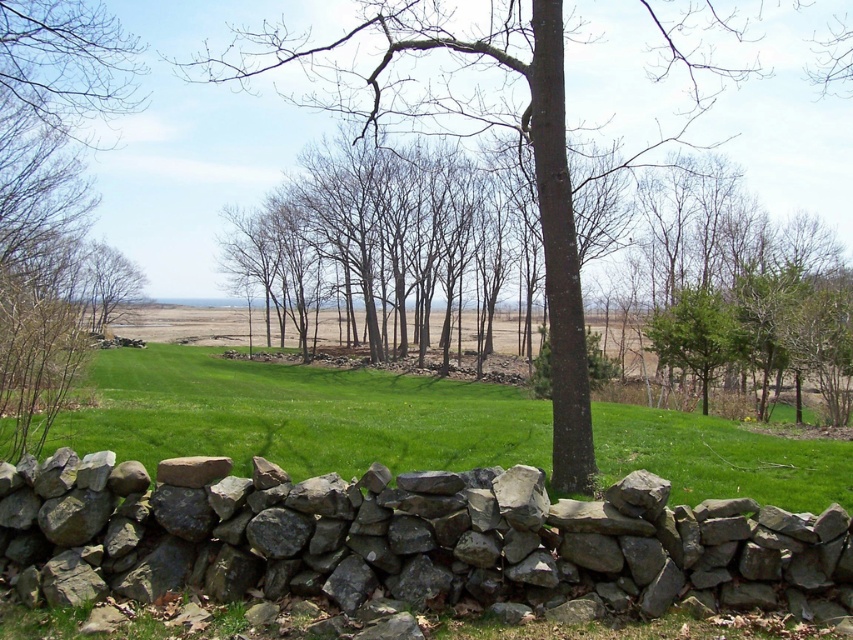
Who is more distant from viewer, (244, 518) or (444, 381)?

Positioned behind is point (444, 381).

Is point (582, 563) closer to camera compared to point (241, 412)?

Yes, point (582, 563) is in front of point (241, 412).

Identify the location of gray rough stone wall at center. The image size is (853, 640). (407, 544).

Looking at this image, does green grass at center appear under bare branches at left?

Yes, green grass at center is below bare branches at left.

Can you confirm if green grass at center is positioned to the left of bare branches at left?

Incorrect, green grass at center is not on the left side of bare branches at left.

Who is more distant from viewer, (318, 419) or (71, 163)?

The point (71, 163) is more distant.

Locate an element on the screen. The width and height of the screenshot is (853, 640). green grass at center is located at coordinates (296, 416).

Between gray rough stone wall at center and brown rough bark tree at center, which one is positioned lower?

gray rough stone wall at center

Who is positioned more to the left, gray rough stone wall at center or brown rough bark tree at center?

gray rough stone wall at center

Image resolution: width=853 pixels, height=640 pixels. What are the coordinates of `gray rough stone wall at center` in the screenshot? It's located at (407, 544).